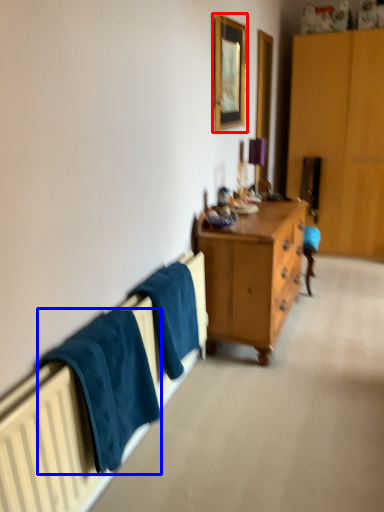
Question: Which object is closer to the camera taking this photo, picture frame (highlighted by a red box) or towel/napkin (highlighted by a blue box)?

Choices:
 (A) picture frame
 (B) towel/napkin

Answer: (B)